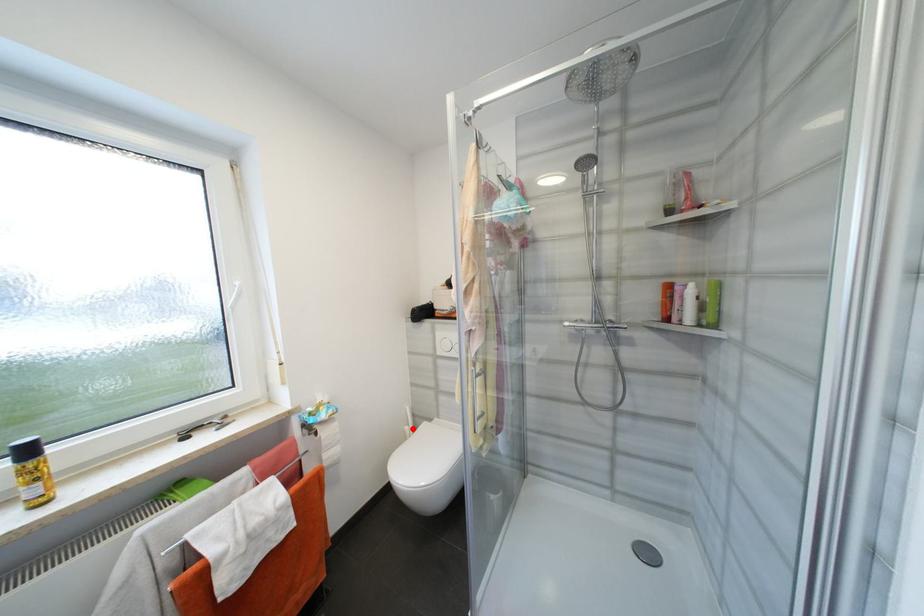
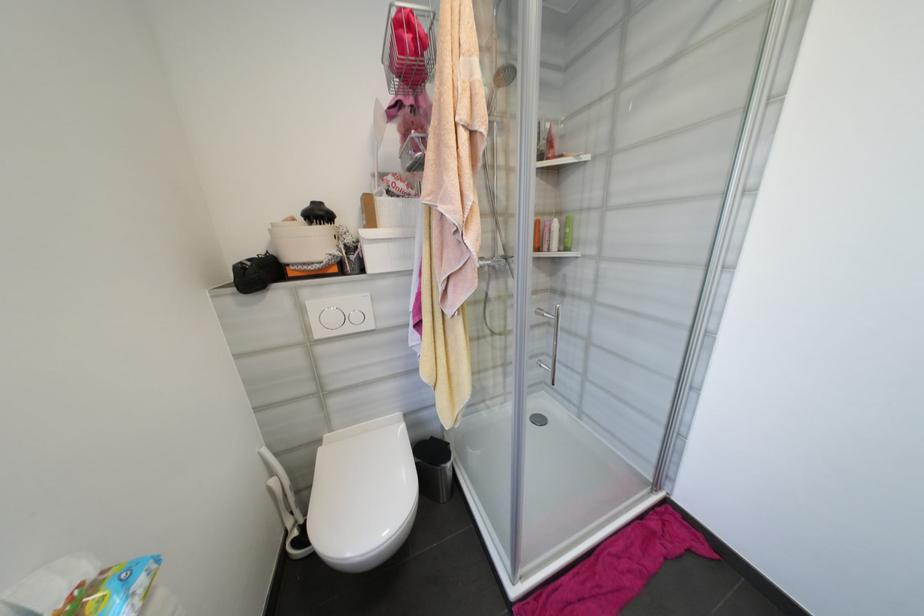
Question: I am providing you with two images of the same scene from different viewpoints. A red point is shown in image1. For the corresponding object point in image2, is it positioned nearer or farther from the camera?

Choices:
 (A) Nearer
 (B) Farther

Answer: (A)